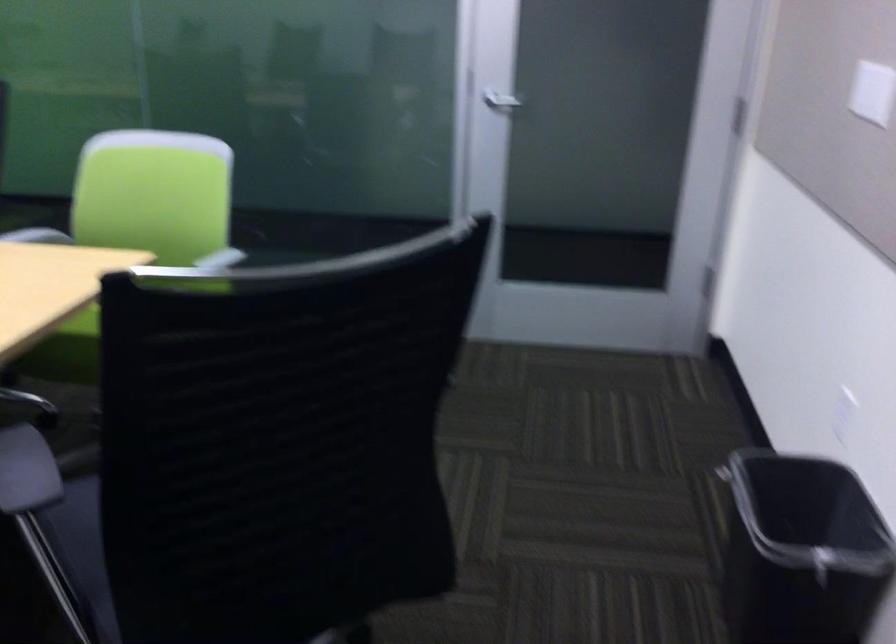
Where is `silver door handle`? This screenshot has width=896, height=644. silver door handle is located at coordinates (501, 102).